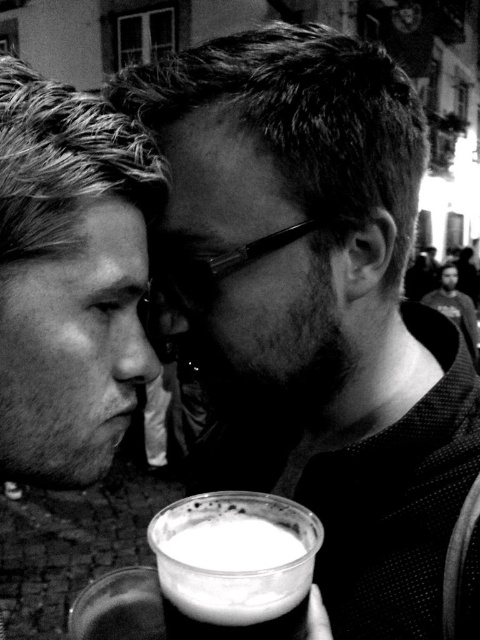
You are a photographer trying to capture a closeup of the white frothy liquid at lower center without including the smooth skin face at left in the frame. Based on their positions, is this possible?

The smooth skin face at left is to the left of the white frothy liquid at lower center, so moving the camera to the right of the liquid could exclude the face while focusing on the liquid.

You are a photographer trying to capture a closeup of the white frothy liquid at lower center without including the smooth skin face at left in the frame. Based on their positions, is this possible?

The smooth skin face at left is further to the viewer than the white frothy liquid at lower center, so the photographer cannot capture a closeup of the white frothy liquid at lower center without including the smooth skin face at left in the frame.

You are a photographer trying to capture a closeup of the white frothy liquid at lower center without including the smooth skin face at left. Based on their sizes, is this possible given the current framing?

The smooth skin face at left is larger in size than the white frothy liquid at lower center, so it might be challenging to capture a closeup of the white frothy liquid at lower center without including the smooth skin face at left due to its larger size occupying more of the frame.